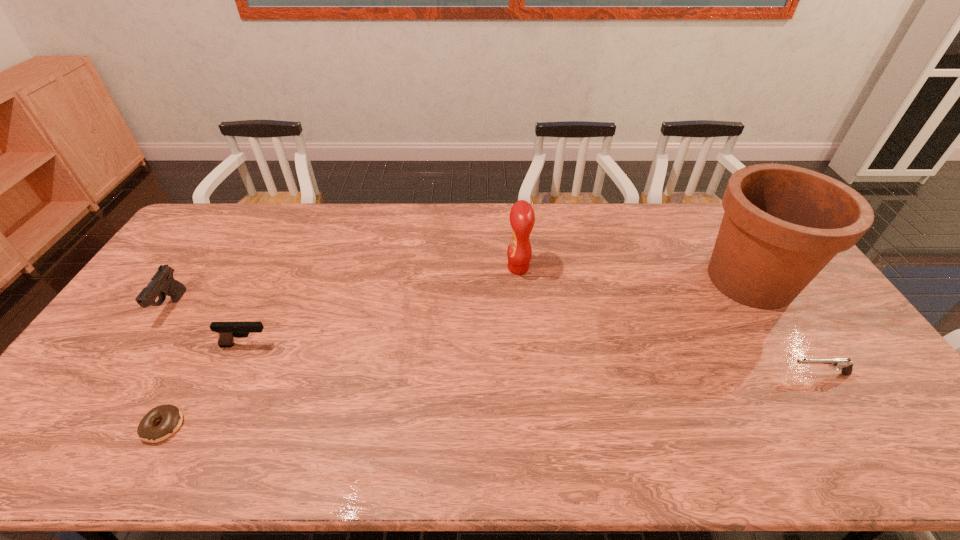
At what (x,y) coordinates should I click in order to perform the action: click on free space at the near left corner of the desktop. Please return your answer as a coordinate pair (x, y). Looking at the image, I should click on (33, 446).

Find the location of a particular element. empty space that is in between the tallest object and the rightmost pistol is located at coordinates (784, 327).

I want to click on unoccupied position between the leftmost pistol and the condiment, so click(346, 287).

You are a GUI agent. You are given a task and a screenshot of the screen. Output one action in this format:
    pyautogui.click(x=<x>, y=<y>)
    Task: Click on the unoccupied position between the nearest pistol and the second tallest object
    This screenshot has width=960, height=540.
    Given the screenshot: What is the action you would take?
    pyautogui.click(x=668, y=321)

This screenshot has height=540, width=960. In order to click on vacant space that's between the second tallest object and the shortest object in this screenshot , I will do (x=341, y=347).

The width and height of the screenshot is (960, 540). What are the coordinates of `free space between the second tallest object and the tallest object` in the screenshot? It's located at (635, 274).

You are a GUI agent. You are given a task and a screenshot of the screen. Output one action in this format:
    pyautogui.click(x=<x>, y=<y>)
    Task: Click on the vacant area between the fourth object from left to right and the fourth tallest object
    
    Given the screenshot: What is the action you would take?
    pyautogui.click(x=382, y=307)

You are a GUI agent. You are given a task and a screenshot of the screen. Output one action in this format:
    pyautogui.click(x=<x>, y=<y>)
    Task: Click on the free space between the second pistol from right to left and the second nearest object
    Image resolution: width=960 pixels, height=540 pixels.
    Given the screenshot: What is the action you would take?
    [x=533, y=360]

This screenshot has width=960, height=540. In order to click on free space between the flowerpot and the doughnut in this screenshot , I will do `click(457, 353)`.

Find the location of a particular element. This screenshot has width=960, height=540. free area in between the flowerpot and the shortest pistol is located at coordinates (784, 327).